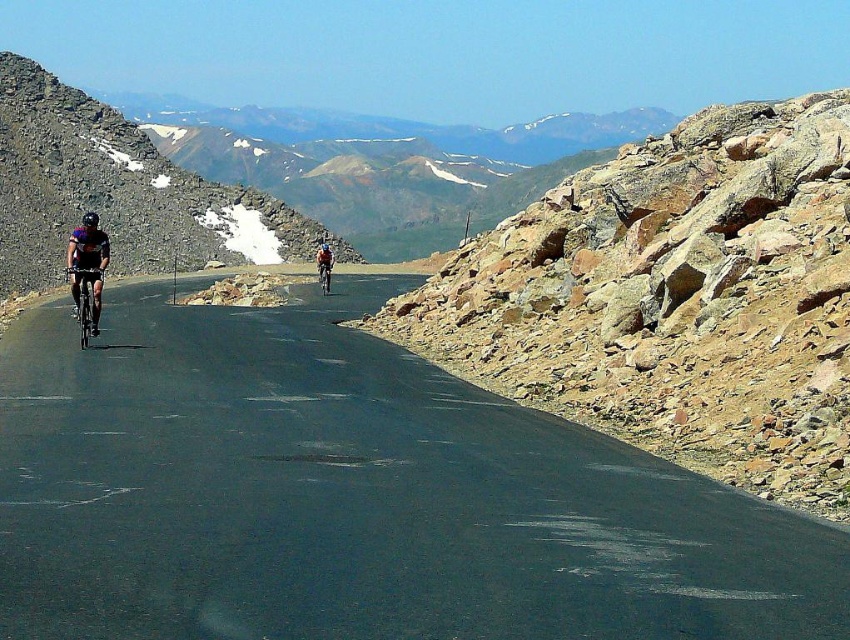
Question: Which point is farther to the camera?

Choices:
 (A) (518, 248)
 (B) (102, 276)
 (C) (324, 291)

Answer: (C)

Question: Which object is closer to the camera taking this photo?

Choices:
 (A) matte black cycling outfit at left
 (B) rocky gray mountain at left
 (C) black asphalt road at center
 (D) shiny black bicycle at left

Answer: (C)

Question: Can you confirm if orange fabric cyclist at center is positioned above matte black helmet at center?

Choices:
 (A) yes
 (B) no

Answer: (B)

Question: Does matte black cycling outfit at left appear on the left side of orange fabric cyclist at center?

Choices:
 (A) no
 (B) yes

Answer: (B)

Question: Among these objects, which one is farthest from the camera?

Choices:
 (A) matte black helmet at center
 (B) orange fabric cyclist at center
 (C) rocky terrain at right
 (D) matte black cycling outfit at left

Answer: (B)

Question: Considering the relative positions of black asphalt road at center and shiny black bicycle at left in the image provided, where is black asphalt road at center located with respect to shiny black bicycle at left?

Choices:
 (A) right
 (B) left

Answer: (A)